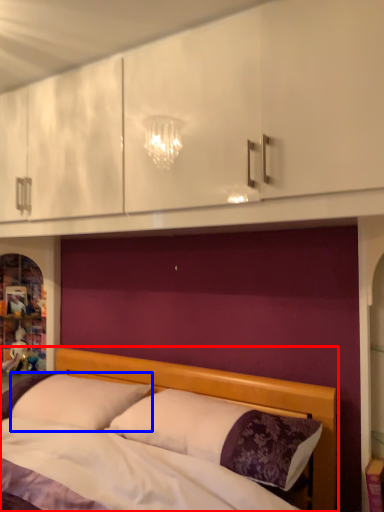
Question: Among these objects, which one is farthest to the camera, bed (highlighted by a red box) or pillow (highlighted by a blue box)?

Choices:
 (A) bed
 (B) pillow

Answer: (B)